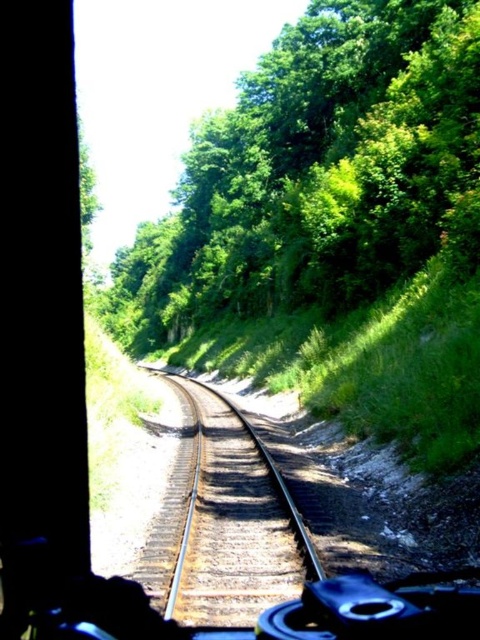
Which of these two, green leafy trees at upper center or metal/smooth train tracks at center, stands taller?

With more height is green leafy trees at upper center.

Which is in front, point (403, 179) or point (165, 525)?

Point (165, 525) is in front.

Identify the location of green leafy trees at upper center. (315, 170).

The image size is (480, 640). Identify the location of green leafy trees at upper center. (315, 170).